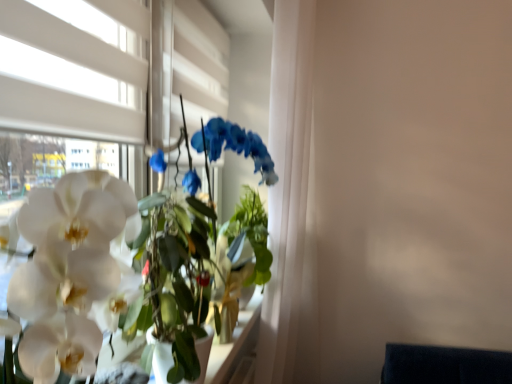
You are a GUI agent. You are given a task and a screenshot of the screen. Output one action in this format:
    pyautogui.click(x=<x>, y=<y>)
    Task: Click on the white glossy orchid at left
    This screenshot has height=384, width=512.
    Given the screenshot: What is the action you would take?
    (x=104, y=273)

What do you see at coordinates (104, 273) in the screenshot? Image resolution: width=512 pixels, height=384 pixels. I see `white glossy orchid at left` at bounding box center [104, 273].

You are a GUI agent. You are given a task and a screenshot of the screen. Output one action in this format:
    pyautogui.click(x=<x>, y=<y>)
    Task: Click on the white matte window at upper left
    
    Given the screenshot: What is the action you would take?
    pyautogui.click(x=73, y=69)

The width and height of the screenshot is (512, 384). What do you see at coordinates (73, 69) in the screenshot? I see `white matte window at upper left` at bounding box center [73, 69].

Identify the location of white glossy orchid at left. This screenshot has height=384, width=512. (104, 273).

Does white matte window at upper left appear on the right side of white glossy orchid at left?

No.

Is white matte window at upper left closer to camera compared to white glossy orchid at left?

No, white matte window at upper left is behind white glossy orchid at left.

Between point (40, 102) and point (59, 287), which one is positioned in front?

The point (59, 287) is in front.

From the image's perspective, is white matte window at upper left above or below white glossy orchid at left?

white matte window at upper left is above white glossy orchid at left.

In the scene shown: From a real-world perspective, which object stands above the other?

In real-world perspective, white matte window at upper left is above.

Considering the sizes of objects white matte window at upper left and white glossy orchid at left in the image provided, who is wider, white matte window at upper left or white glossy orchid at left?

white glossy orchid at left is wider.

From their relative heights in the image, would you say white matte window at upper left is taller or shorter than white glossy orchid at left?

white matte window at upper left is taller than white glossy orchid at left.

Is white matte window at upper left bigger or smaller than white glossy orchid at left?

white matte window at upper left is smaller than white glossy orchid at left.

Can we say white matte window at upper left lies outside white glossy orchid at left?

Absolutely, white matte window at upper left is external to white glossy orchid at left.

Does white matte window at upper left touch white glossy orchid at left?

No.

Does white matte window at upper left turn towards white glossy orchid at left?

No, white matte window at upper left does not turn towards white glossy orchid at left.

Can you tell me how much white matte window at upper left and white glossy orchid at left differ in facing direction?

The facing directions of white matte window at upper left and white glossy orchid at left are 0.0248 degrees apart.

Measure the distance from white matte window at upper left to white glossy orchid at left.

A distance of 12.00 inches exists between white matte window at upper left and white glossy orchid at left.

Find the location of a particular element. window on the left of white glossy orchid at left is located at coordinates (73, 69).

From the picture: Considering the relative positions of white glossy orchid at left and white matte window at upper left in the image provided, is white glossy orchid at left to the left of white matte window at upper left from the viewer's perspective?

No, white glossy orchid at left is not to the left of white matte window at upper left.

Relative to white matte window at upper left, is white glossy orchid at left in front or behind?

Clearly, white glossy orchid at left is in front of white matte window at upper left.

Is point (91, 178) behind point (85, 56)?

No, it is not.

From the image's perspective, which object appears higher, white glossy orchid at left or white matte window at upper left?

white matte window at upper left.

From a real-world perspective, which object rests below the other?

white glossy orchid at left.

Does white glossy orchid at left have a greater width compared to white matte window at upper left?

Correct, the width of white glossy orchid at left exceeds that of white matte window at upper left.

Consider the image. Considering the sizes of objects white glossy orchid at left and white matte window at upper left in the image provided, who is shorter, white glossy orchid at left or white matte window at upper left?

white glossy orchid at left is shorter.

From the picture: Between white glossy orchid at left and white matte window at upper left, which one has smaller size?

With smaller size is white matte window at upper left.

Could white matte window at upper left be considered to be inside white glossy orchid at left?

No, white matte window at upper left is not surrounded by white glossy orchid at left.

Is there a large distance between white glossy orchid at left and white matte window at upper left?

No, white glossy orchid at left is not far away from white matte window at upper left.

Is white glossy orchid at left aimed at white matte window at upper left?

No, white glossy orchid at left is not aimed at white matte window at upper left.

How far apart are white glossy orchid at left and white matte window at upper left?

white glossy orchid at left is 12.00 inches away from white matte window at upper left.

Image resolution: width=512 pixels, height=384 pixels. In order to click on houseplant located in front of the white matte window at upper left in this screenshot , I will do `click(104, 273)`.

The image size is (512, 384). Find the location of `window above the white glossy orchid at left (from a real-world perspective)`. window above the white glossy orchid at left (from a real-world perspective) is located at coordinates (73, 69).

In the image, there is a white matte window at upper left. Identify the location of houseplant below it (from the image's perspective). This screenshot has height=384, width=512. (104, 273).